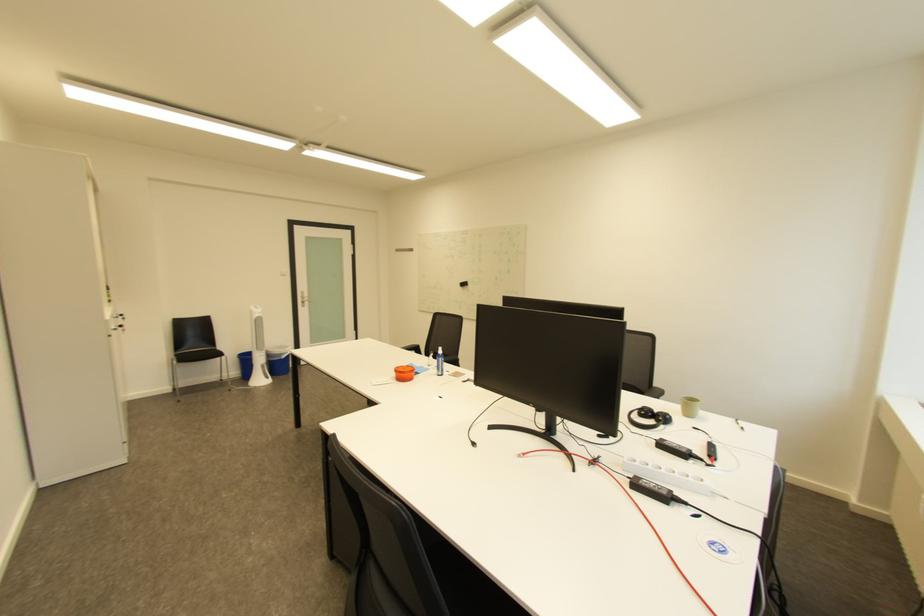
Locate an element on the screen. Image resolution: width=924 pixels, height=616 pixels. white tower fan is located at coordinates (258, 350).